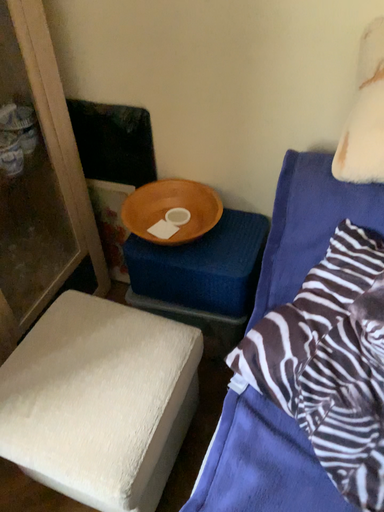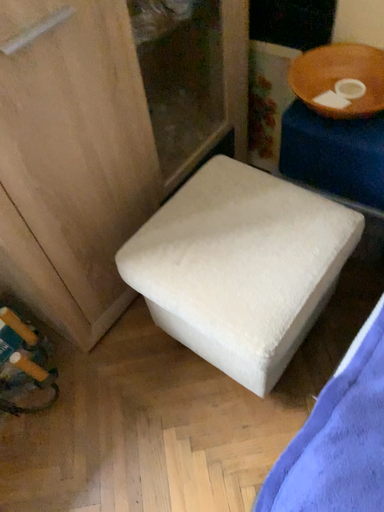
Question: Which way did the camera rotate in the video?

Choices:
 (A) rotated right
 (B) rotated left

Answer: (B)